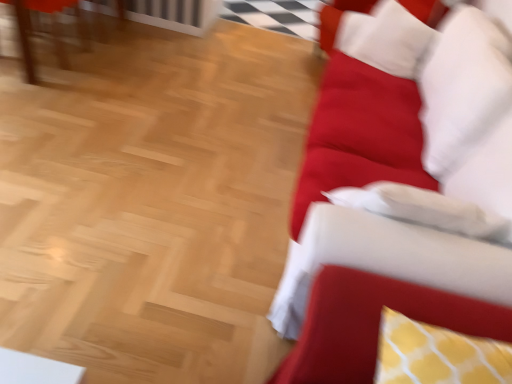
Question: Is velvet red couch at right at the back of matte wooden table at upper left?

Choices:
 (A) yes
 (B) no

Answer: (A)

Question: From the image's perspective, is matte wooden table at upper left below velvet red couch at right?

Choices:
 (A) no
 (B) yes

Answer: (A)

Question: Can you confirm if matte wooden table at upper left is positioned to the right of velvet red couch at right?

Choices:
 (A) no
 (B) yes

Answer: (A)

Question: Could velvet red couch at right be considered to be inside matte wooden table at upper left?

Choices:
 (A) no
 (B) yes

Answer: (A)

Question: Is matte wooden table at upper left oriented towards velvet red couch at right?

Choices:
 (A) yes
 (B) no

Answer: (B)

Question: Is yellow dotted cushion at right bigger or smaller than white soft pillow at upper right?

Choices:
 (A) big
 (B) small

Answer: (B)

Question: Considering the positions of point (309, 365) and point (406, 33), is point (309, 365) closer or farther from the camera than point (406, 33)?

Choices:
 (A) farther
 (B) closer

Answer: (B)

Question: Which is correct: yellow dotted cushion at right is inside white soft pillow at upper right, or outside of it?

Choices:
 (A) outside
 (B) inside

Answer: (A)

Question: From their relative heights in the image, would you say yellow dotted cushion at right is taller or shorter than white soft pillow at upper right?

Choices:
 (A) tall
 (B) short

Answer: (B)

Question: Is matte wooden table at upper left wider or thinner than white soft pillow at upper right?

Choices:
 (A) wide
 (B) thin

Answer: (A)

Question: Considering the relative positions of matte wooden table at upper left and white soft pillow at upper right in the image provided, is matte wooden table at upper left to the left or to the right of white soft pillow at upper right?

Choices:
 (A) right
 (B) left

Answer: (B)

Question: From the image's perspective, is matte wooden table at upper left positioned above or below white soft pillow at upper right?

Choices:
 (A) below
 (B) above

Answer: (B)

Question: Which is correct: matte wooden table at upper left is inside white soft pillow at upper right, or outside of it?

Choices:
 (A) inside
 (B) outside

Answer: (B)

Question: Looking at their shapes, would you say matte wooden table at upper left is wider or thinner than yellow dotted cushion at right?

Choices:
 (A) wide
 (B) thin

Answer: (A)

Question: Is matte wooden table at upper left taller or shorter than yellow dotted cushion at right?

Choices:
 (A) tall
 (B) short

Answer: (A)